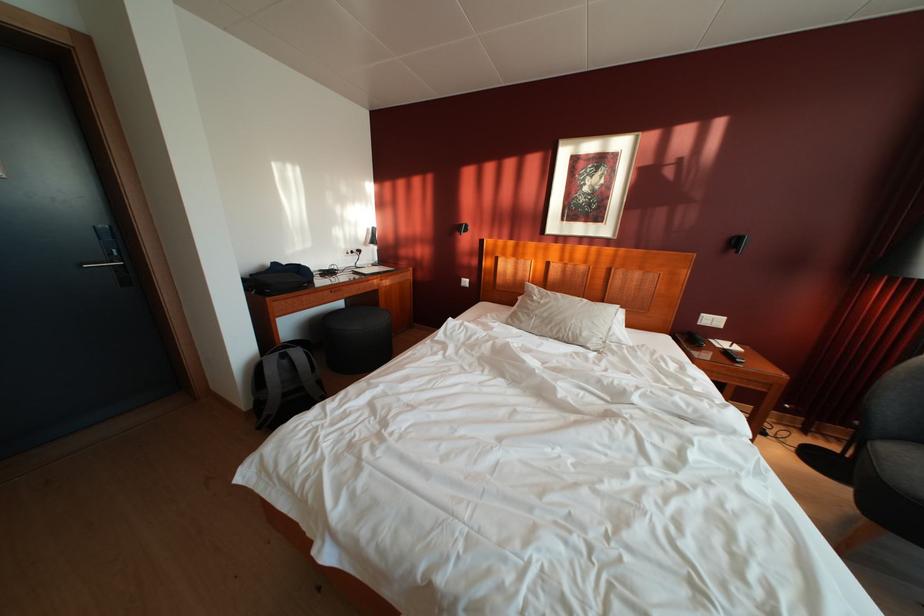
Find where to push the white light switch. Please return your answer as a coordinate pair (x, y).

(719, 321)